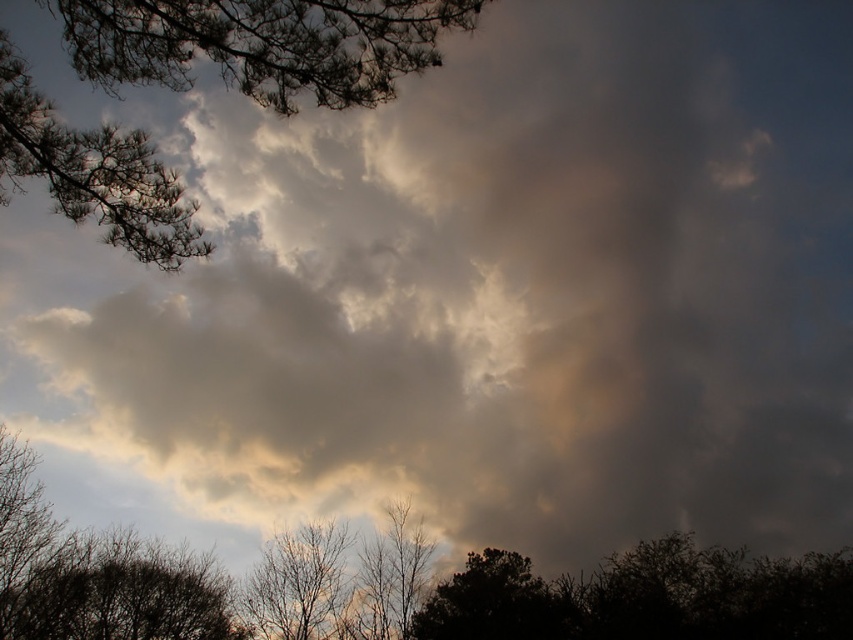
You are a bird looking for a place to perch. You see the brown textured tree at lower left and the dark green leafy tree at bottom. Which tree is closer to you?

Both trees are the same distance from you since they are positioned at the bottom of the image.

You are standing at the center of the scene and want to locate the brown textured tree at lower left. Based on the coordinates provided, in which direction should you look to find it?

The brown textured tree at lower left is located at coordinates point (x=119, y=593), which means you should look towards the lower left direction from the center to find it.